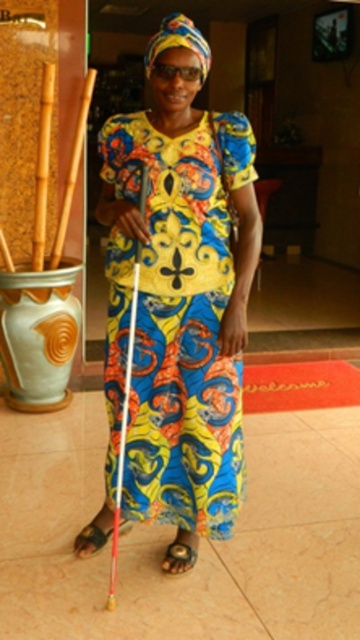
Who is more distant from viewer, (177, 540) or (93, 548)?

The point (93, 548) is more distant.

Which of these two, black leather sandal at lower center or brown leather sandal at lower left, stands taller?

With more height is black leather sandal at lower center.

Who is more forward, (169, 568) or (77, 545)?

Positioned in front is point (169, 568).

Image resolution: width=360 pixels, height=640 pixels. I want to click on black leather sandal at lower center, so click(x=180, y=556).

Between point (153, 48) and point (87, 532), which one is positioned behind?

Positioned behind is point (87, 532).

Does point (195, 426) come behind point (92, 554)?

No, (195, 426) is closer to viewer.

Where is `matte colorful dress at center`? The image size is (360, 640). matte colorful dress at center is located at coordinates (177, 292).

Does point (225, 230) come farther from viewer compared to point (171, 545)?

No.

The width and height of the screenshot is (360, 640). Find the location of `matte colorful dress at center`. matte colorful dress at center is located at coordinates (177, 292).

Where is `matte colorful dress at center`? The height and width of the screenshot is (640, 360). matte colorful dress at center is located at coordinates (177, 292).